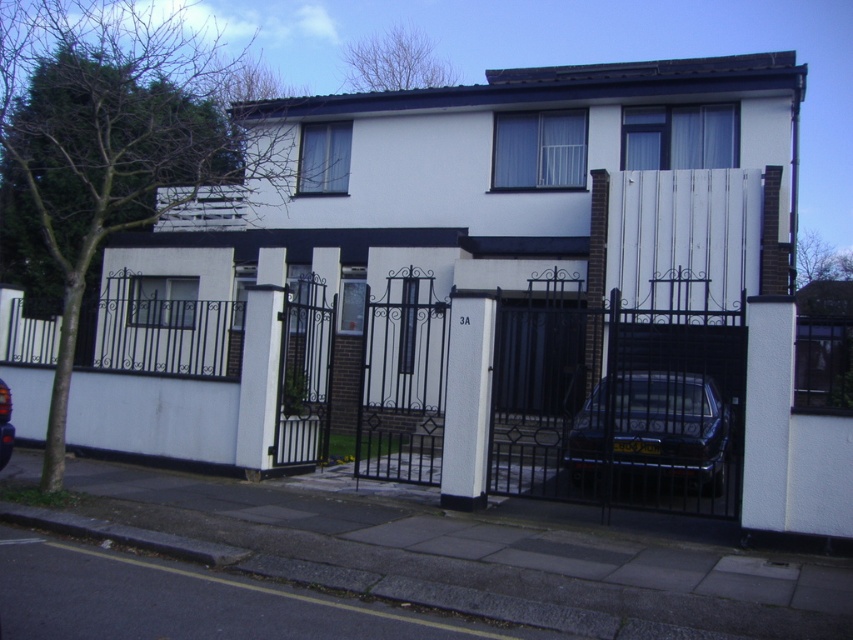
Question: Does black wrought iron gate at center have a larger size compared to shiny dark blue sedan at center?

Choices:
 (A) no
 (B) yes

Answer: (B)

Question: Based on their relative distances, which object is farther from the black wrought iron gate at center?

Choices:
 (A) shiny dark blue sedan at center
 (B) shiny black car at center

Answer: (B)

Question: Which point appears closest to the camera in this image?

Choices:
 (A) 1,452
 (B) 622,467

Answer: (A)

Question: Is black wrought iron gate at center in front of shiny dark blue sedan at center?

Choices:
 (A) no
 (B) yes

Answer: (B)

Question: Can you confirm if black wrought iron gate at center is bigger than shiny black car at center?

Choices:
 (A) no
 (B) yes

Answer: (B)

Question: Considering the real-world distances, which object is closest to the shiny black car at center?

Choices:
 (A) black wrought iron gate at center
 (B) shiny dark blue sedan at center

Answer: (A)